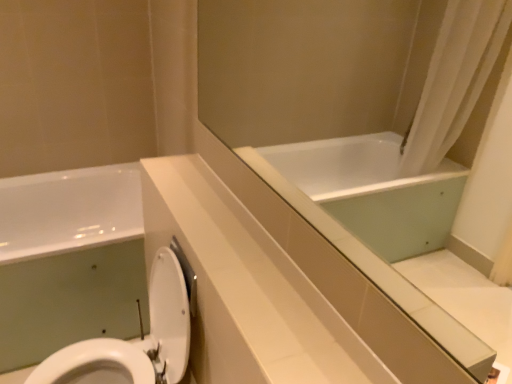
Question: Choose the correct answer: Is white glossy toilet at lower left inside white glossy bathtub at lower left or outside it?

Choices:
 (A) outside
 (B) inside

Answer: (A)

Question: Considering their positions, is white glossy toilet at lower left located in front of or behind white glossy bathtub at lower left?

Choices:
 (A) front
 (B) behind

Answer: (A)

Question: Which is nearer to the white glossy toilet at lower left?

Choices:
 (A) white glossy bathtub at lower left
 (B) white glossy counter top at center

Answer: (B)

Question: Which is nearer to the white glossy bathtub at lower left?

Choices:
 (A) white glossy toilet at lower left
 (B) white glossy counter top at center

Answer: (A)